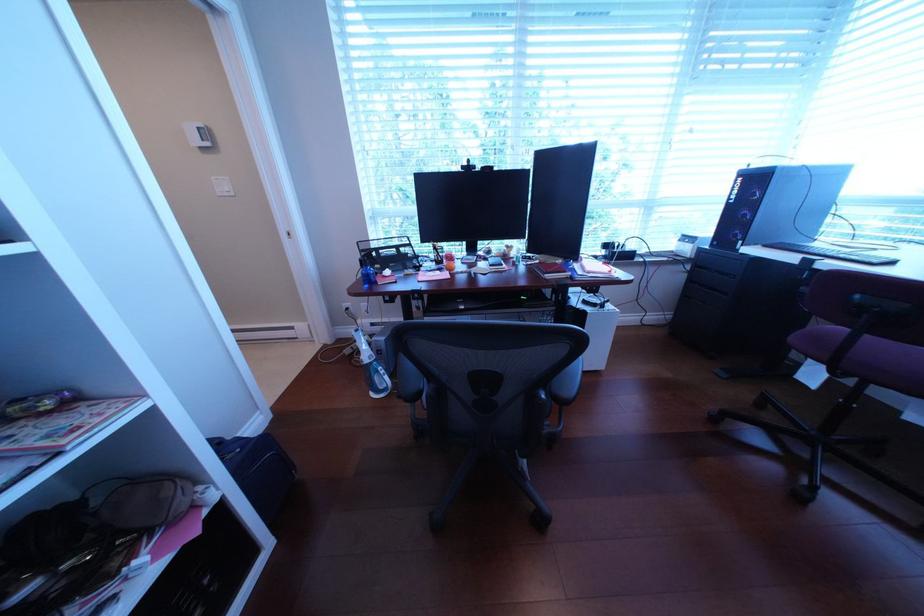
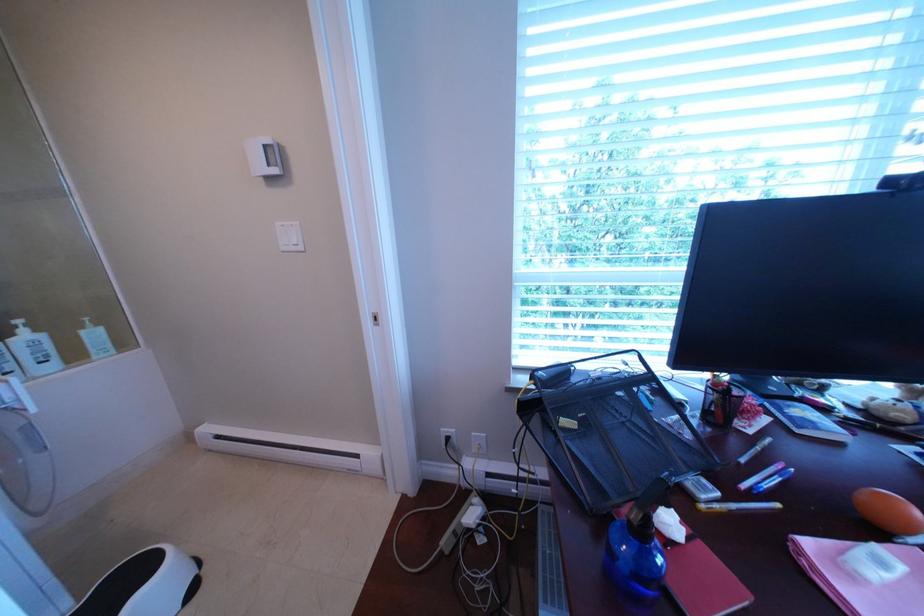
Which direction would the cameraman need to move to produce the second image?

The movement direction of the cameraman is left, forward.